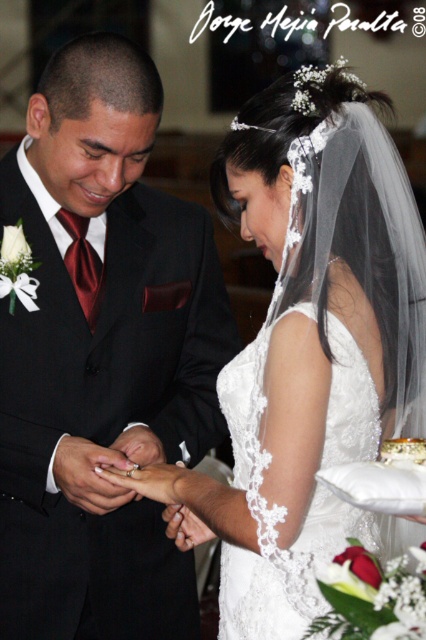
Question: Can you confirm if white lace dress at center is wider than white textured cake at center?

Choices:
 (A) yes
 (B) no

Answer: (A)

Question: Which object is positioned farthest from the white textured cake at center?

Choices:
 (A) silver metallic ring at center
 (B) lace fabric wedding dress at center

Answer: (A)

Question: Which of the following is the closest to the observer?

Choices:
 (A) (317, 80)
 (B) (134, 468)
 (C) (9, 216)

Answer: (A)

Question: Is lace fabric wedding dress at center above silver metallic ring at center?

Choices:
 (A) yes
 (B) no

Answer: (A)

Question: Is white lace dress at center smaller than white textured cake at center?

Choices:
 (A) no
 (B) yes

Answer: (A)

Question: Which object is the closest to the matte black suit at center?

Choices:
 (A) silver metallic ring at center
 (B) lace fabric wedding dress at center

Answer: (B)